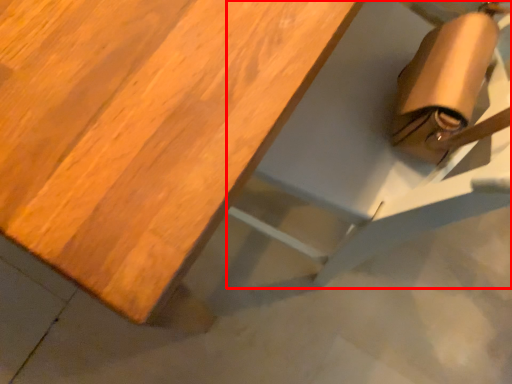
Question: From the image's perspective, considering the relative positions of chair (annotated by the red box) and table in the image provided, where is chair (annotated by the red box) located with respect to the staircase?

Choices:
 (A) above
 (B) below

Answer: (B)